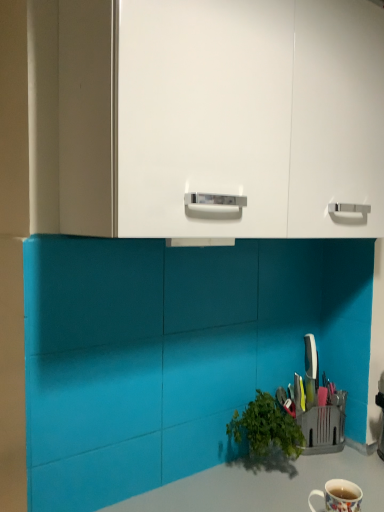
Question: Is white glossy mug at lower right oriented away from smooth gray countertop at lower center?

Choices:
 (A) yes
 (B) no

Answer: (B)

Question: Considering the relative sizes of white glossy mug at lower right and smooth gray countertop at lower center in the image provided, is white glossy mug at lower right wider than smooth gray countertop at lower center?

Choices:
 (A) no
 (B) yes

Answer: (A)

Question: From a real-world perspective, is white glossy mug at lower right under smooth gray countertop at lower center?

Choices:
 (A) yes
 (B) no

Answer: (B)

Question: Does white glossy mug at lower right turn towards smooth gray countertop at lower center?

Choices:
 (A) yes
 (B) no

Answer: (B)

Question: Considering the relative positions of white glossy mug at lower right and smooth gray countertop at lower center in the image provided, is white glossy mug at lower right behind smooth gray countertop at lower center?

Choices:
 (A) no
 (B) yes

Answer: (B)

Question: From a real-world perspective, is smooth gray countertop at lower center above or below white glossy mug at lower right?

Choices:
 (A) below
 (B) above

Answer: (A)

Question: From the image's perspective, is smooth gray countertop at lower center positioned above or below white glossy mug at lower right?

Choices:
 (A) below
 (B) above

Answer: (A)

Question: Would you say smooth gray countertop at lower center is inside or outside white glossy mug at lower right?

Choices:
 (A) inside
 (B) outside

Answer: (B)

Question: In the image, is smooth gray countertop at lower center positioned in front of or behind white glossy mug at lower right?

Choices:
 (A) behind
 (B) front

Answer: (B)

Question: Is white glossy cabinet at upper center in front of or behind smooth gray countertop at lower center in the image?

Choices:
 (A) behind
 (B) front

Answer: (B)

Question: Looking at the image, does white glossy cabinet at upper center seem bigger or smaller compared to smooth gray countertop at lower center?

Choices:
 (A) small
 (B) big

Answer: (A)

Question: Considering the positions of white glossy cabinet at upper center and smooth gray countertop at lower center in the image, is white glossy cabinet at upper center taller or shorter than smooth gray countertop at lower center?

Choices:
 (A) tall
 (B) short

Answer: (A)

Question: From the image's perspective, is white glossy cabinet at upper center positioned above or below smooth gray countertop at lower center?

Choices:
 (A) below
 (B) above

Answer: (B)

Question: Considering the positions of white glossy mug at lower right and smooth gray countertop at lower center in the image, is white glossy mug at lower right taller or shorter than smooth gray countertop at lower center?

Choices:
 (A) tall
 (B) short

Answer: (B)

Question: In terms of width, does white glossy mug at lower right look wider or thinner when compared to smooth gray countertop at lower center?

Choices:
 (A) thin
 (B) wide

Answer: (A)